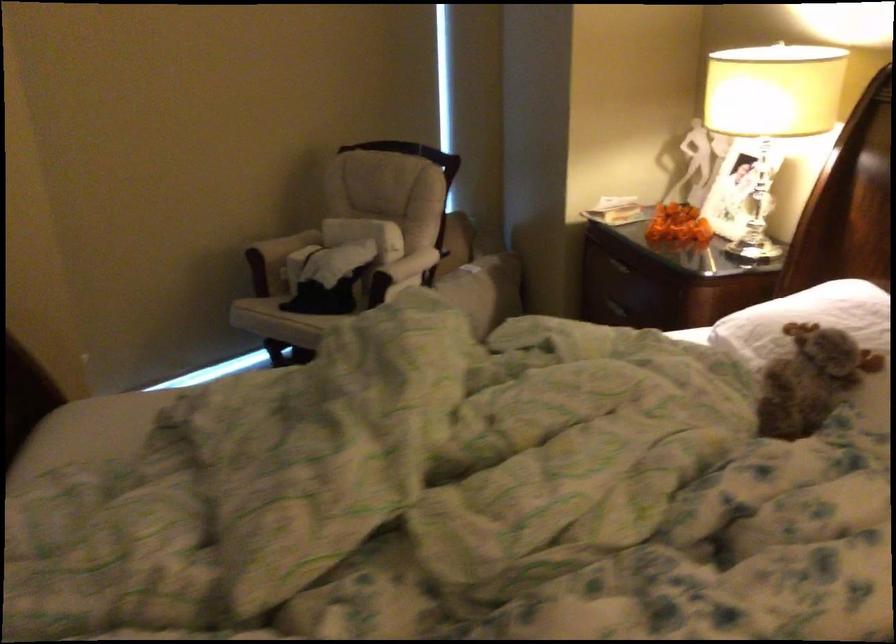
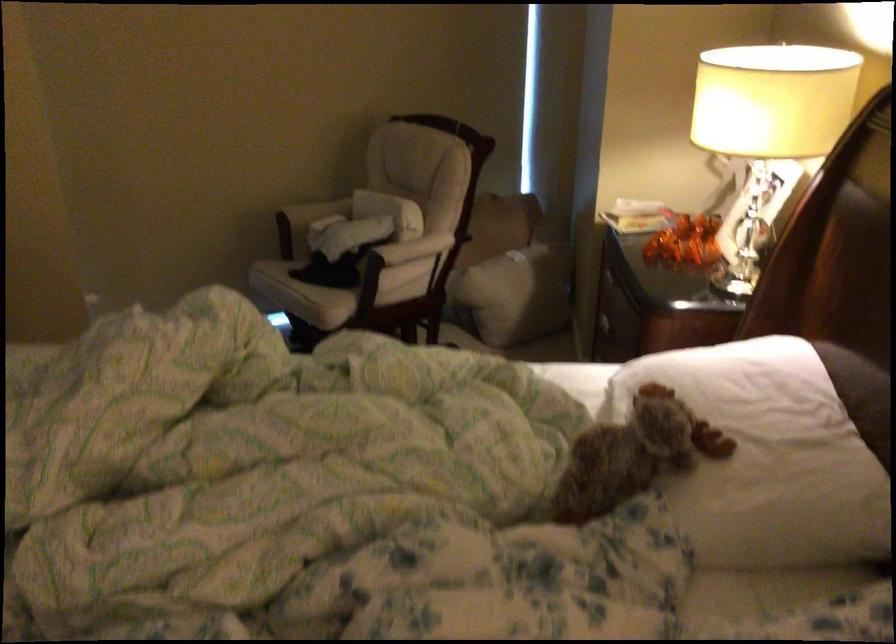
Locate, in the second image, the point that corresponds to point 418,266 in the first image.

(415, 250)